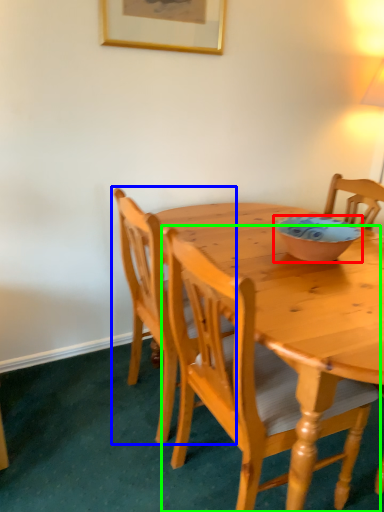
Question: Which object is positioned closest to bowl (highlighted by a red box)? Select from chair (highlighted by a blue box) and chair (highlighted by a green box).

Choices:
 (A) chair
 (B) chair

Answer: (B)